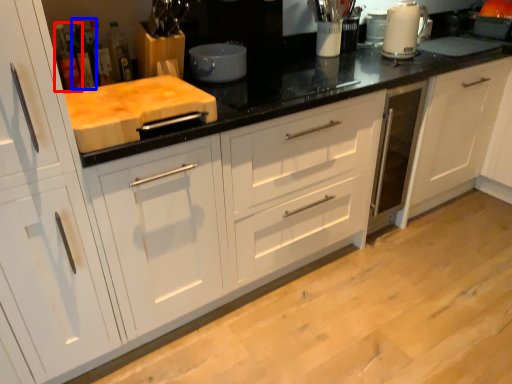
Question: Which object is further to the camera taking this photo, bottle (highlighted by a red box) or bottle (highlighted by a blue box)?

Choices:
 (A) bottle
 (B) bottle

Answer: (B)